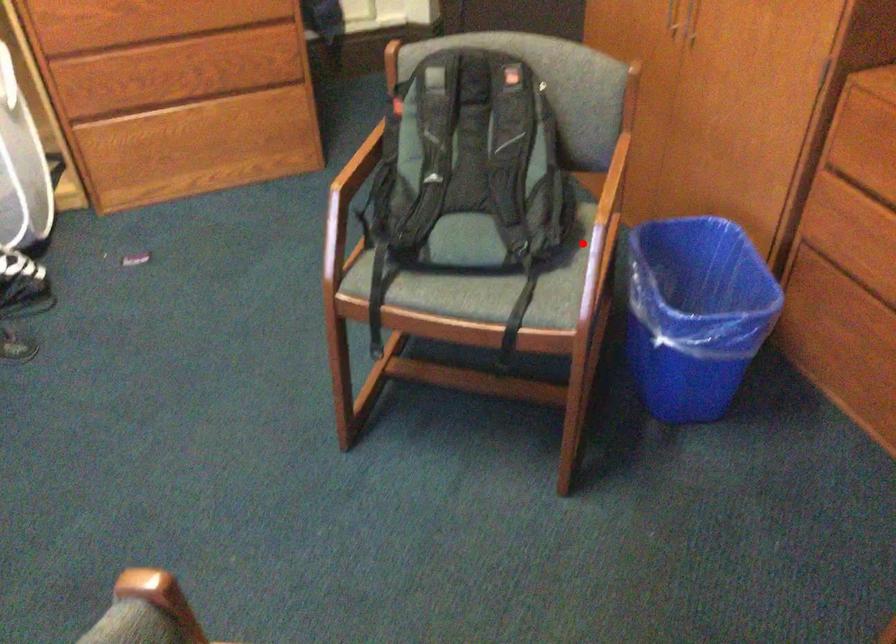
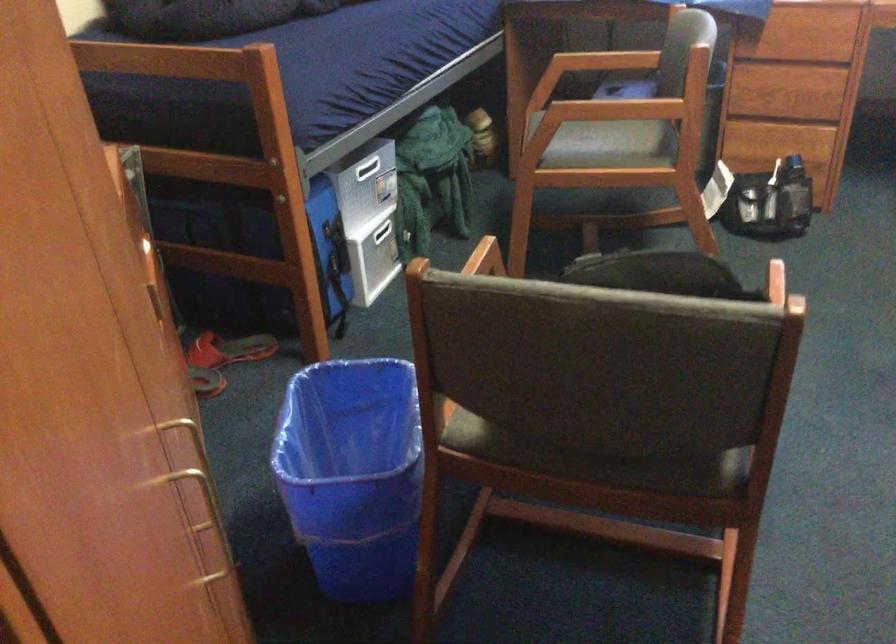
The point at the highlighted location is marked in the first image. Where is the corresponding point in the second image?

(487, 257)